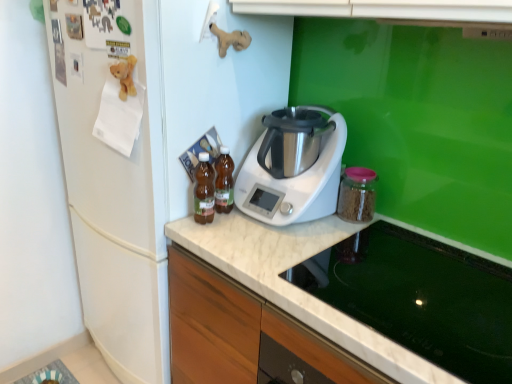
Locate an element on the screen. The height and width of the screenshot is (384, 512). free location to the left of transparent glass jar at right, which is the first kitchen appliance in right-to-left order is located at coordinates (315, 226).